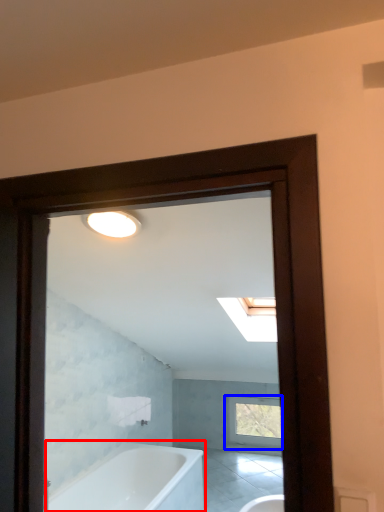
Question: Which point is closer to the camera, bathtub (highlighted by a red box) or window (highlighted by a blue box)?

Choices:
 (A) bathtub
 (B) window

Answer: (A)